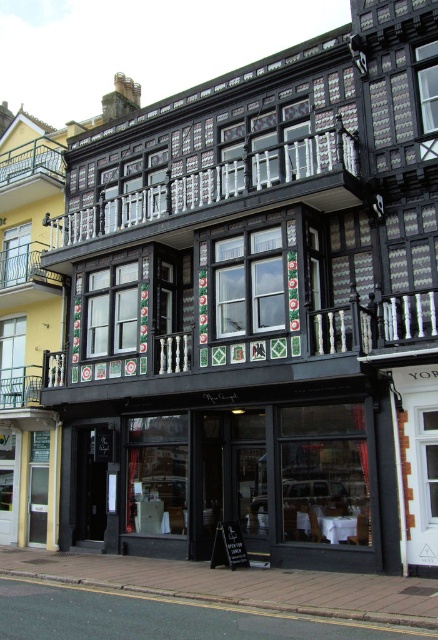
You are a delivery person trying to find the entrance to the restaurant. You see the black glass storefront at center and the matte black building at center. Which one is more likely to have the entrance?

The black glass storefront at center is more likely to have the entrance because it is smaller than the matte black building at center, and entrances are typically located in smaller sections of a building.

You are standing in front of the two story building. Where is the black glass storefront at center located?

The black glass storefront at center is located at point (229, 477).